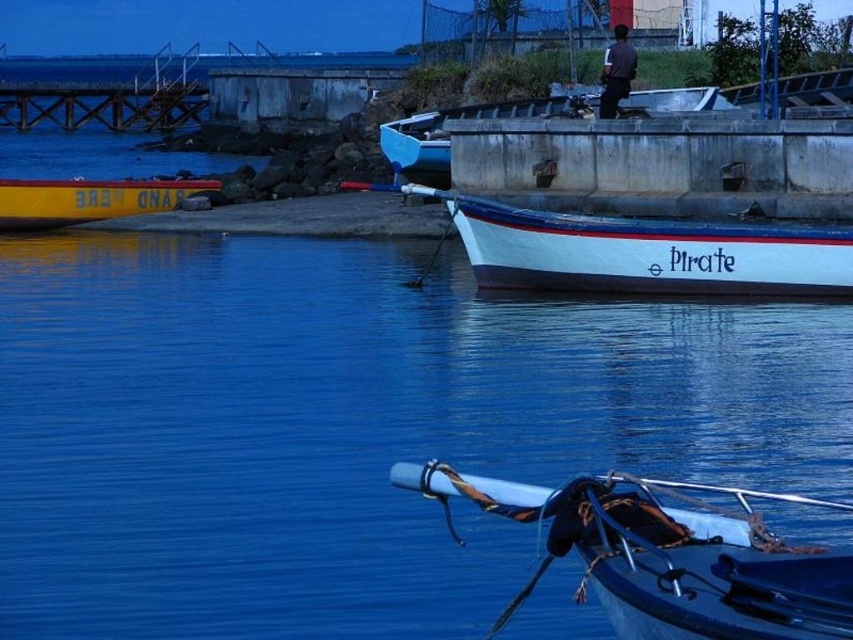
Consider the image. Based on the scene description, where is the white matte boat at upper center located in terms of coordinates?

The white matte boat at upper center is located at coordinates (350, 428).

You are planning to board the white matte boat at center and the yellow matte boat at left. Based on their sizes, which boat might provide more headroom for taller passengers?

The white matte boat at center is much taller than the yellow matte boat at left, so it would provide more headroom for taller passengers.